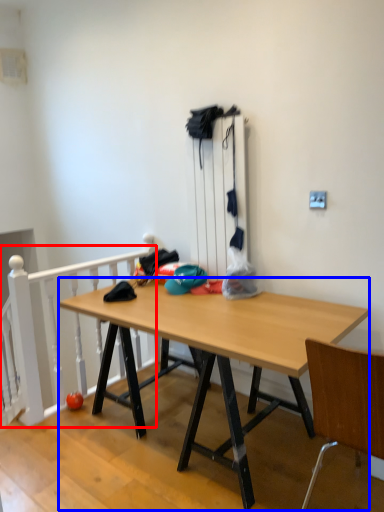
Question: Which object is further to the camera taking this photo, rail (highlighted by a red box) or desk (highlighted by a blue box)?

Choices:
 (A) rail
 (B) desk

Answer: (A)